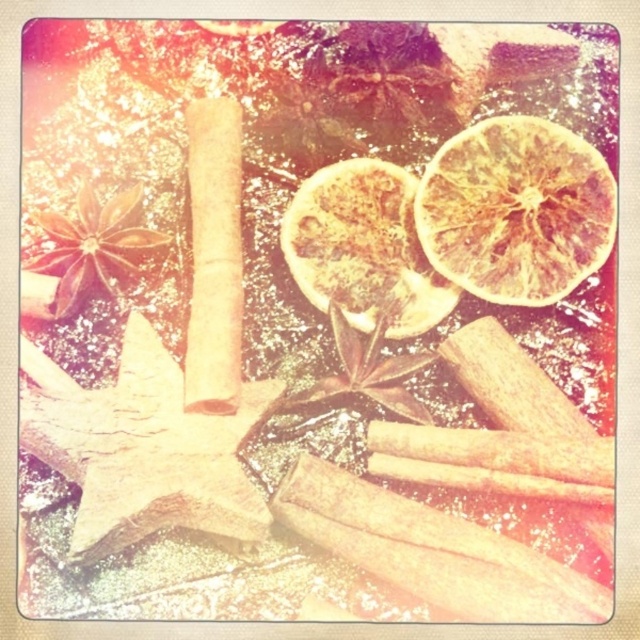
You are preparing a gift basket and want to include the largest dried orange from the image. Which one should you choose between the dried orange at upper right and the dried orange at center?

The dried orange at upper right is larger in width than the dried orange at center, so you should choose the dried orange at upper right.

You are a chef preparing a spice arrangement and want to place a new cinnamon stick between the dried orange at upper right and the dried orange at center. The cinnamon stick is 2 inches long. Will it fit between them?

The dried orange at upper right and dried orange at center are 5.25 inches apart, so a cinnamon stick that is 2 inches long will fit between them since the distance is greater than the stick length.